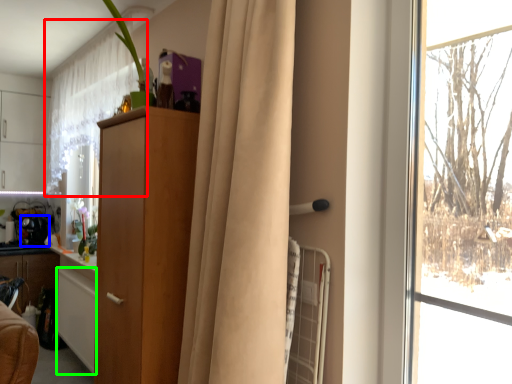
Question: Estimate the real-world distances between objects in this image. Which object is farther from curtain (highlighted by a red box), appliance (highlighted by a blue box) or cabinetry (highlighted by a green box)?

Choices:
 (A) appliance
 (B) cabinetry

Answer: (A)